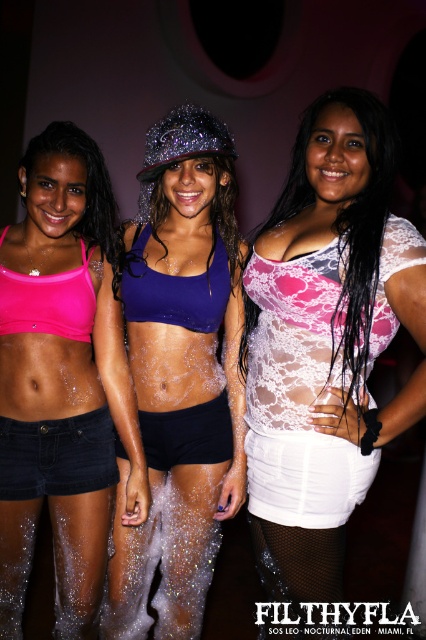
Looking at this image, does purple shiny sports bra at center have a lesser width compared to satin shiny shorts at center?

In fact, purple shiny sports bra at center might be wider than satin shiny shorts at center.

Who is positioned more to the left, purple shiny sports bra at center or satin shiny shorts at center?

satin shiny shorts at center

Between point (207, 308) and point (149, 433), which one is positioned in front?

Point (207, 308) is more forward.

I want to click on purple shiny sports bra at center, so click(x=181, y=374).

Is lace fabric top at center taller than purple shiny sports bra at center?

Incorrect, lace fabric top at center's height is not larger of purple shiny sports bra at center's.

Who is taller, lace fabric top at center or purple shiny sports bra at center?

Standing taller between the two is purple shiny sports bra at center.

Describe the element at coordinates (328, 324) in the screenshot. I see `lace fabric top at center` at that location.

Find the location of a particular element. lace fabric top at center is located at coordinates (328, 324).

What do you see at coordinates (328, 324) in the screenshot? Image resolution: width=426 pixels, height=640 pixels. I see `lace fabric top at center` at bounding box center [328, 324].

Is point (291, 225) positioned after point (54, 266)?

Yes, point (291, 225) is behind point (54, 266).

The width and height of the screenshot is (426, 640). What do you see at coordinates (328, 324) in the screenshot?
I see `lace fabric top at center` at bounding box center [328, 324].

The image size is (426, 640). I want to click on lace fabric top at center, so click(x=328, y=324).